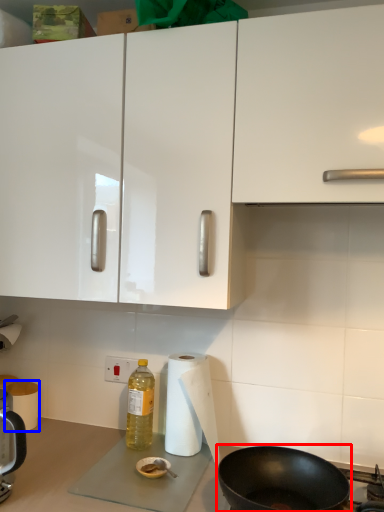
Question: Which object is closer to the camera taking this photo, frying pan (highlighted by a red box) or paper towel (highlighted by a blue box)?

Choices:
 (A) frying pan
 (B) paper towel

Answer: (A)